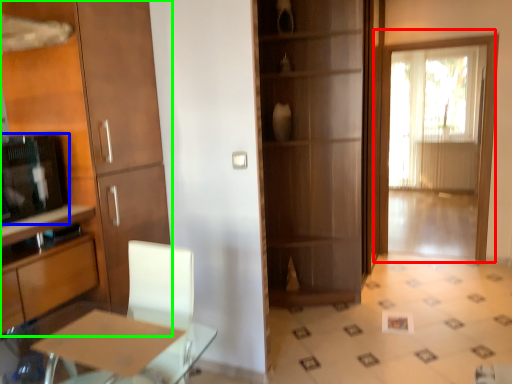
Question: Estimate the real-world distances between objects in this image. Which object is closer to door (highlighted by a red box), appliance (highlighted by a blue box) or cabinetry (highlighted by a green box)?

Choices:
 (A) appliance
 (B) cabinetry

Answer: (B)